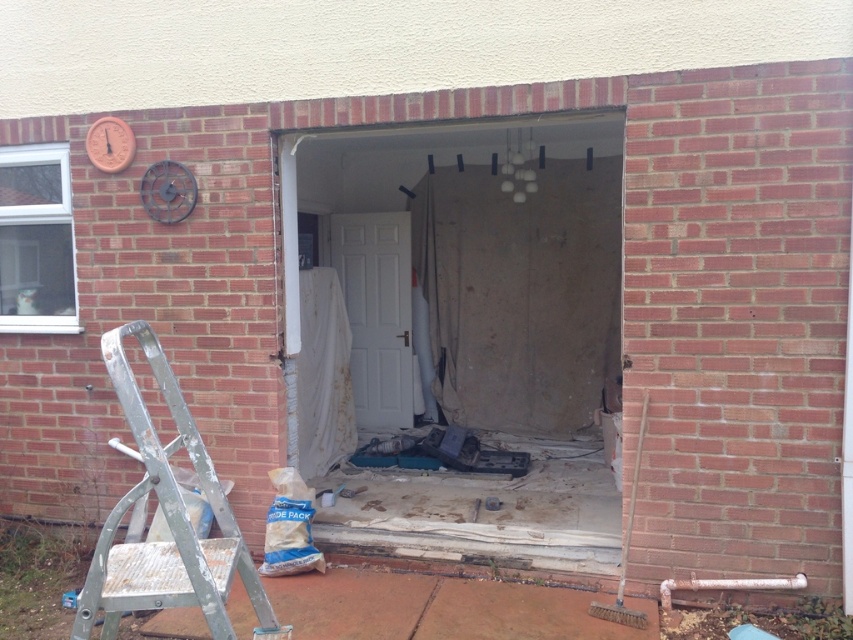
Can you confirm if silver metallic ladder at left is positioned to the left of white matte door at center?

Yes, silver metallic ladder at left is to the left of white matte door at center.

Who is more distant from viewer, (131,579) or (345,268)?

Point (345,268)

You are a GUI agent. You are given a task and a screenshot of the screen. Output one action in this format:
    pyautogui.click(x=<x>, y=<y>)
    Task: Click on the silver metallic ladder at left
    
    Given the screenshot: What is the action you would take?
    pyautogui.click(x=166, y=518)